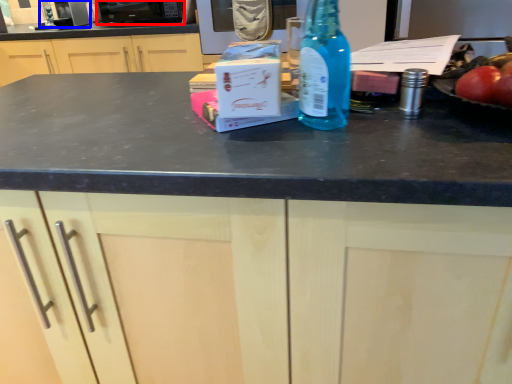
Question: Among these objects, which one is nearest to the camera, appliance (highlighted by a red box) or appliance (highlighted by a blue box)?

Choices:
 (A) appliance
 (B) appliance

Answer: (A)